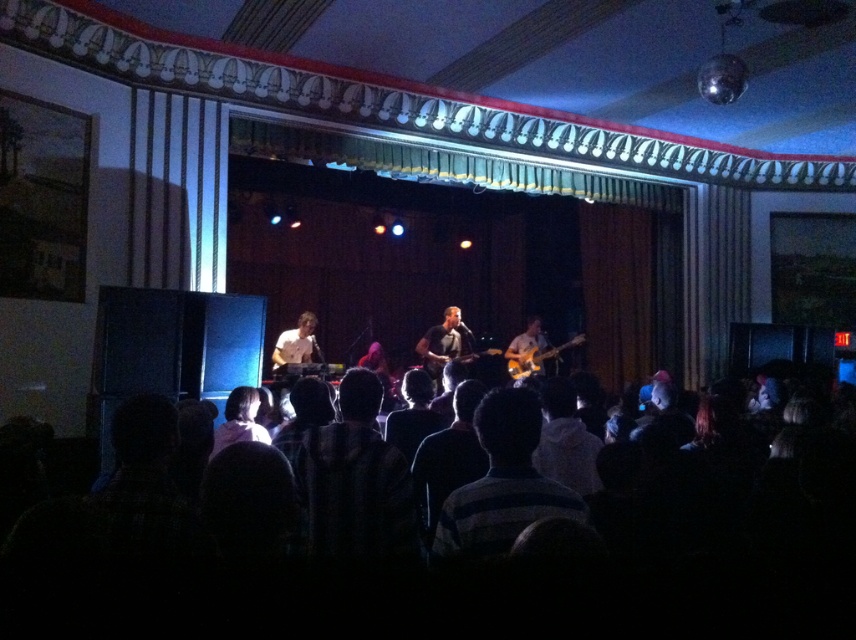
Question: Does striped cotton shirt at center appear on the right side of orange glossy electric guitar at center?

Choices:
 (A) no
 (B) yes

Answer: (A)

Question: Which object appears closest to the camera in this image?

Choices:
 (A) striped cotton shirt at center
 (B) dark fabric crowd at lower center

Answer: (B)

Question: In this image, where is dark fabric crowd at lower center located relative to orange glossy electric guitar at center?

Choices:
 (A) above
 (B) below

Answer: (B)

Question: Which of the following is the closest to the observer?

Choices:
 (A) (482, 524)
 (B) (195, 573)
 (C) (521, 353)

Answer: (B)

Question: Estimate the real-world distances between objects in this image. Which object is farther from the orange glossy electric guitar at center?

Choices:
 (A) dark fabric crowd at lower center
 (B) striped cotton shirt at center

Answer: (B)

Question: Is dark fabric crowd at lower center thinner than orange glossy electric guitar at center?

Choices:
 (A) no
 (B) yes

Answer: (A)